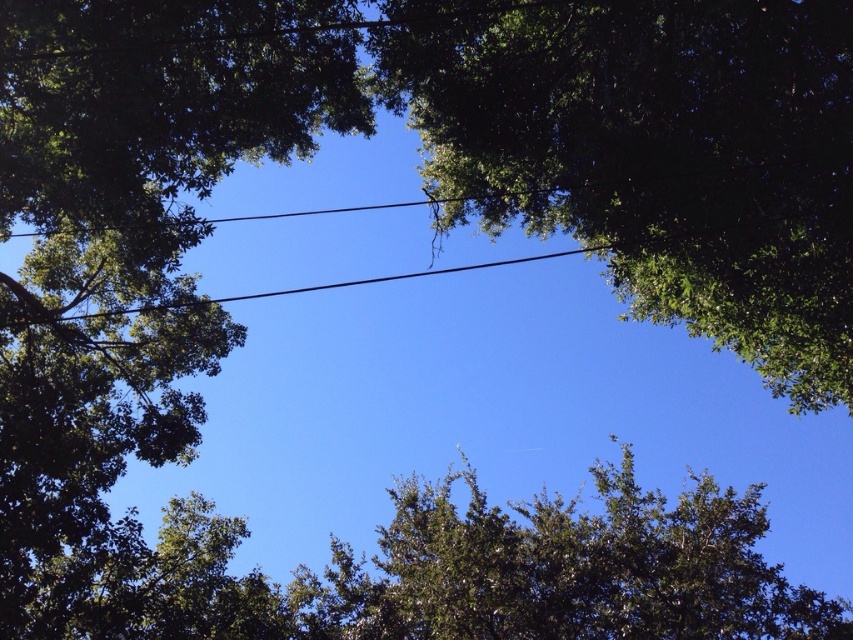
From the picture: You are a bird flying through the forest and want to land on the highest tree. Which tree should you choose between the green leafy tree at upper center and the green leafy tree at center?

The green leafy tree at upper center is taller than the green leafy tree at center, so you should choose the green leafy tree at upper center to land on.

You are a bird flying through the forest canopy. You see the green leafy tree at upper center and the green leafy tree at center. Which tree would you need to navigate around more carefully due to its larger size?

The green leafy tree at center is larger, so you would need to navigate around it more carefully than the green leafy tree at upper center.